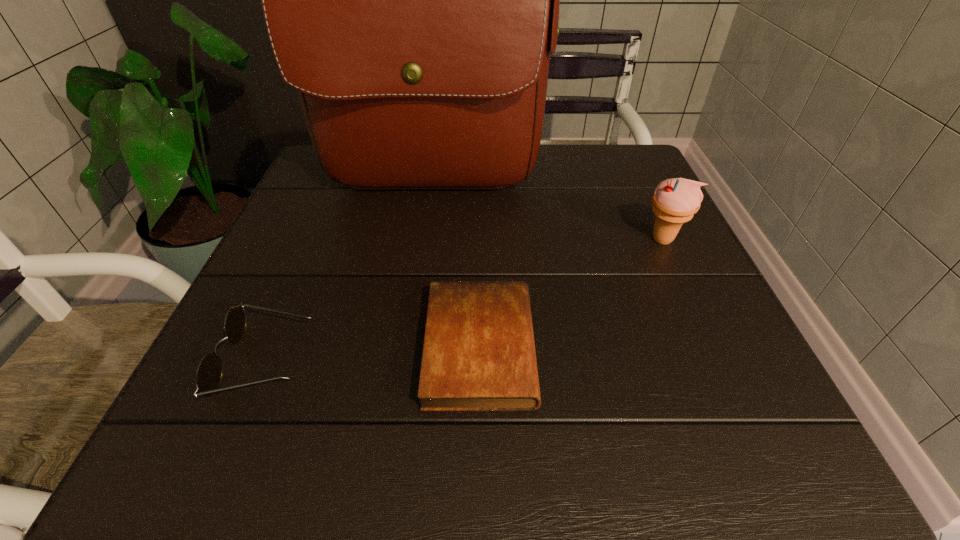
Image resolution: width=960 pixels, height=540 pixels. Identify the location of the farthest object. (412, 0).

I want to click on satchel, so click(x=412, y=0).

Image resolution: width=960 pixels, height=540 pixels. What are the coordinates of `the second tallest object` in the screenshot? It's located at (675, 201).

Where is `icecream`? icecream is located at coordinates (675, 201).

Where is `spectacles`? spectacles is located at coordinates (209, 373).

Locate an element on the screen. the shortest object is located at coordinates (479, 354).

Where is `free space located on the open flap of the farthest object`? Image resolution: width=960 pixels, height=540 pixels. free space located on the open flap of the farthest object is located at coordinates (421, 253).

Image resolution: width=960 pixels, height=540 pixels. I want to click on free space located 0.280m on the left of the icecream, so click(x=500, y=239).

Locate an element on the screen. This screenshot has width=960, height=540. vacant point located on the front-facing side of the spectacles is located at coordinates (452, 361).

This screenshot has height=540, width=960. I want to click on vacant space located on the spine side of the Bible, so click(x=661, y=347).